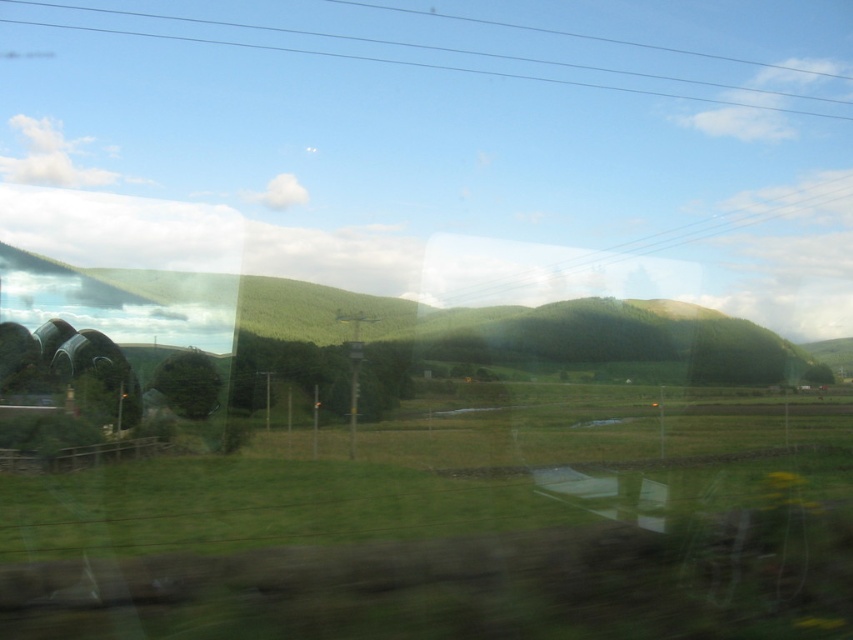
You are sitting in the train and looking out the window. There is a point marked at coordinates (450, 321). What is located at that point?

At point (450, 321) lies green grassy hill at center.

You are a passenger on a train and notice two objects outside the window. The first is clear blue wires at upper center and the second is green matte tree at center. Which object appears bigger in size?

The clear blue wires at upper center has a larger size compared to the green matte tree at center.

You are a passenger on a train and notice two green grassy areas outside the window. The first is labeled as the green grassy field at center, and the second is the green grassy hill at center. Which of these two areas appears to be larger in size from your viewpoint?

The green grassy hill at center appears larger in size than the green grassy field at center because the description states that the green grassy field at center is smaller than the green grassy hill at center.